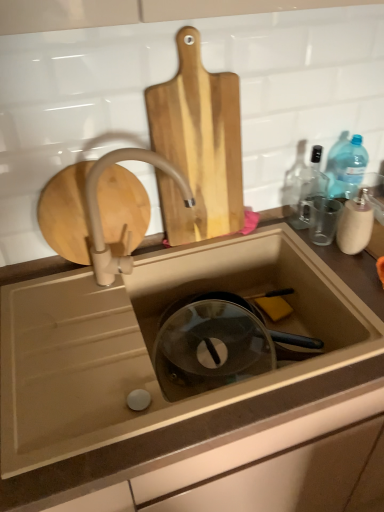
Identify the location of free space between transparent glass bottle at upper right and natural wood cutting board at upper center. Image resolution: width=384 pixels, height=512 pixels. (264, 227).